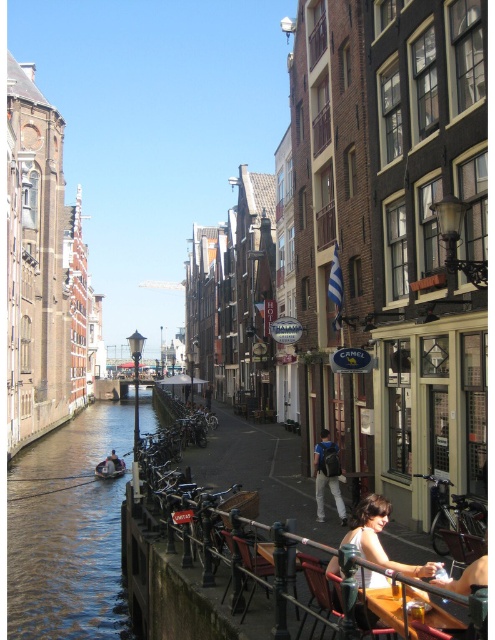
You are standing at the point with coordinates point [336,564] and want to walk towards the point with coordinates point [97,500]. Which direction should you face to move towards it?

Since point [97,500] is behind point [336,564], you should face backwards to move towards it.

You are a tour guide leading a group along the canal. You want to point out the clear water at lower left and the shops on the right side of the canal. How far apart are these two landmarks?

The clear water at lower left and the shops on the right side of the canal are 61.20 meters apart.